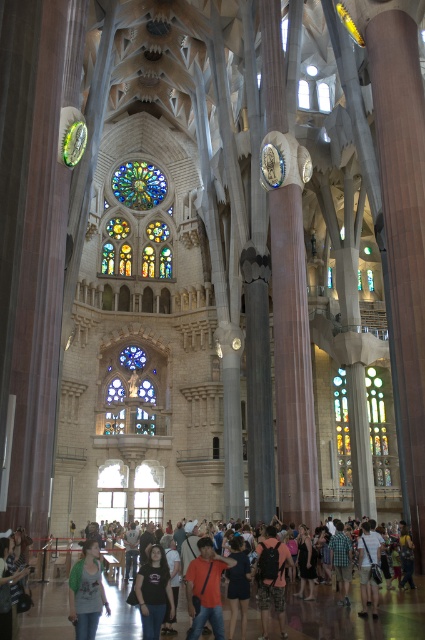
In the scene shown: Can you confirm if denim jacket at lower center is positioned below denim jacket at lower right?

Incorrect, denim jacket at lower center is not positioned below denim jacket at lower right.

What do you see at coordinates (368, 566) in the screenshot?
I see `denim jacket at lower center` at bounding box center [368, 566].

I want to click on denim jacket at lower center, so click(368, 566).

Between light blue denim jeans at center and dark brown backpack at center, which one has more height?

light blue denim jeans at center

Is light blue denim jeans at center to the right of dark brown backpack at center from the viewer's perspective?

Incorrect, light blue denim jeans at center is not on the right side of dark brown backpack at center.

Measure the distance between light blue denim jeans at center and camera.

119.45 feet

Where is `light blue denim jeans at center`? The height and width of the screenshot is (640, 425). light blue denim jeans at center is located at coordinates (87, 592).

Is stained glass window at center shorter than dark brown backpack at center?

Incorrect, stained glass window at center's height does not fall short of dark brown backpack at center's.

From the picture: Which is below, stained glass window at center or dark brown backpack at center?

dark brown backpack at center is below.

Image resolution: width=425 pixels, height=640 pixels. What do you see at coordinates (138, 184) in the screenshot?
I see `stained glass window at center` at bounding box center [138, 184].

At what (x,y) coordinates should I click in order to perform the action: click on stained glass window at center. Please return your answer as a coordinate pair (x, y). Looking at the image, I should click on (138, 184).